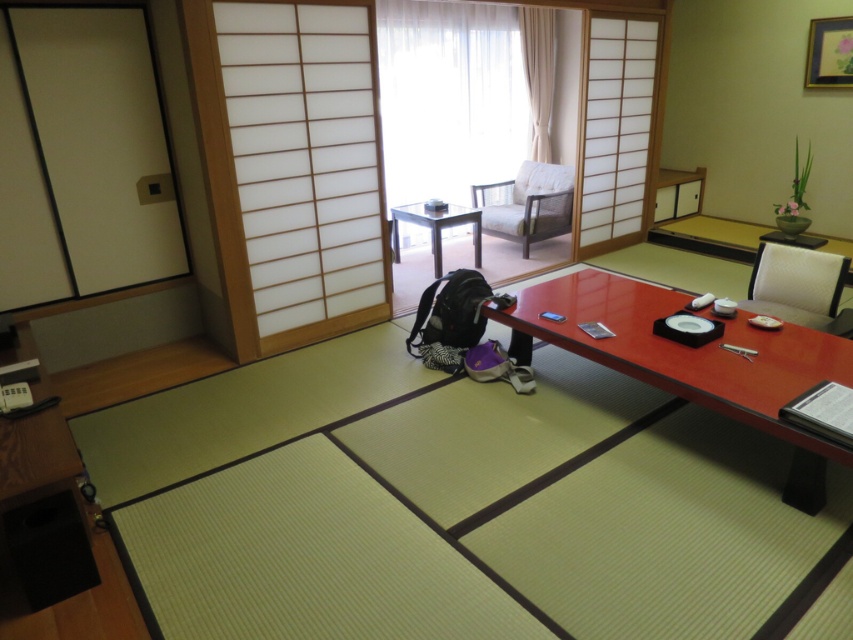
Question: Which point appears closest to the camera in this image?

Choices:
 (A) (793, 440)
 (B) (524, 10)
 (C) (810, 304)
 (D) (479, 236)

Answer: (A)

Question: Which object is positioned farthest from the wooden table at center?

Choices:
 (A) white fabric chair at right
 (B) light brown wood chair at upper center

Answer: (A)

Question: From the image, what is the correct spatial relationship of smooth red wooden table at center in relation to light brown wood chair at upper center?

Choices:
 (A) left
 (B) right

Answer: (B)

Question: Does white fabric chair at right have a larger size compared to wooden table at center?

Choices:
 (A) yes
 (B) no

Answer: (B)

Question: Can you confirm if smooth red wooden table at center is bigger than light brown wood chair at upper center?

Choices:
 (A) no
 (B) yes

Answer: (B)

Question: Which point is closer to the camera taking this photo?

Choices:
 (A) (782, 314)
 (B) (693, 388)
 (C) (395, 216)

Answer: (B)